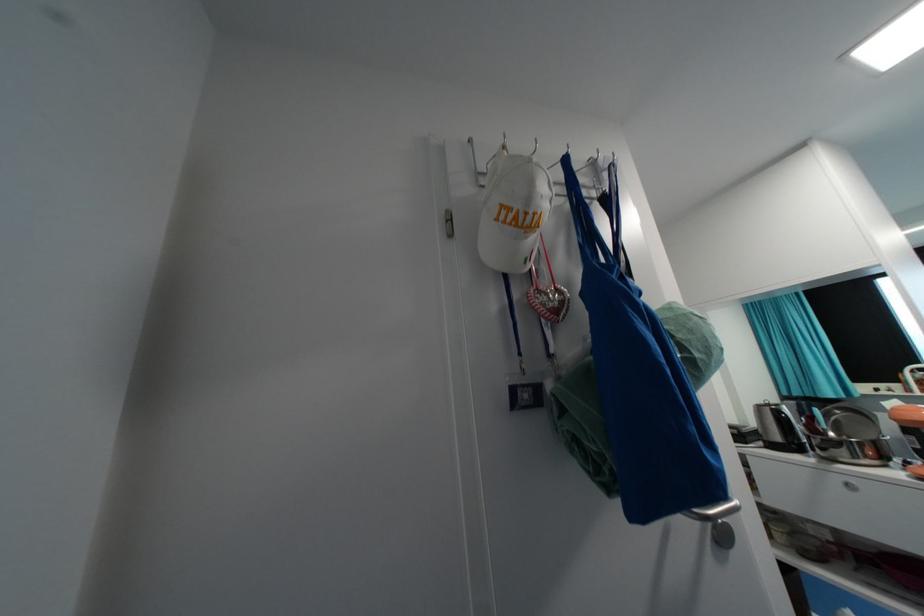
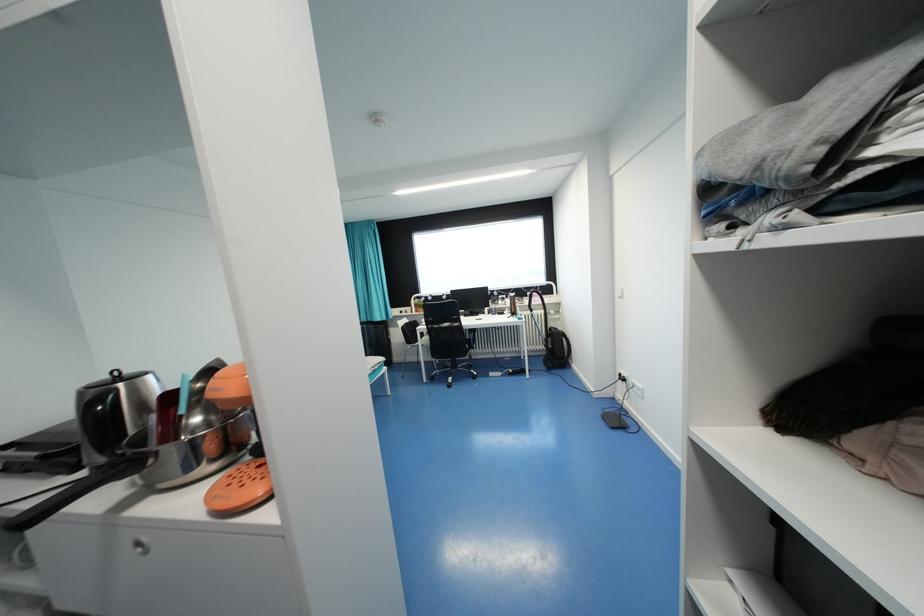
Find the pixel in the second image that matches (x=835, y=435) in the first image.

(201, 419)